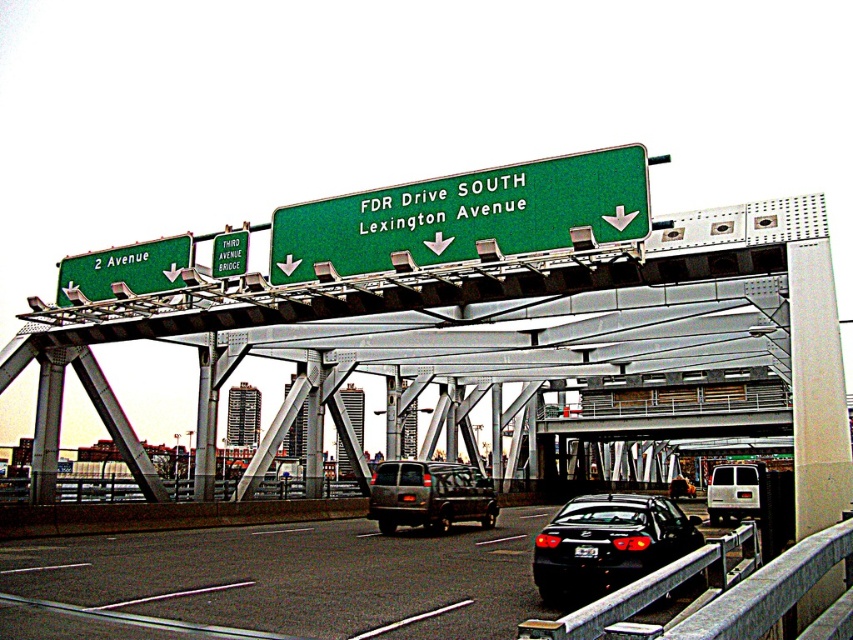
Question: Which object is closer to the camera taking this photo?

Choices:
 (A) shiny black sedan at center
 (B) metallic gray bridge at center
 (C) black asphalt highway at center
 (D) green matte sign at upper center

Answer: (C)

Question: Does green matte highway sign at center appear on the left side of matte gray suv at center?

Choices:
 (A) yes
 (B) no

Answer: (A)

Question: Among these objects, which one is nearest to the camera?

Choices:
 (A) green matte highway sign at center
 (B) metallic gray bridge at center
 (C) green matte sign at upper left

Answer: (B)

Question: Where is black asphalt highway at center located in relation to green matte sign at upper left in the image?

Choices:
 (A) right
 (B) left

Answer: (A)

Question: Which of the following is the farthest from the observer?

Choices:
 (A) (248, 573)
 (B) (756, 476)
 (C) (294, 333)

Answer: (B)

Question: Is black asphalt highway at center positioned behind matte gray suv at center?

Choices:
 (A) yes
 (B) no

Answer: (B)